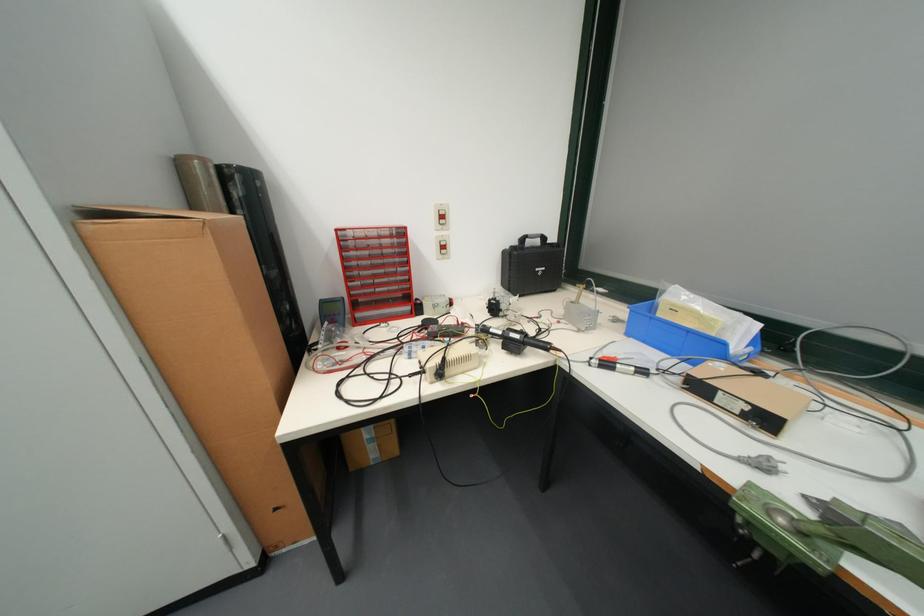
Find the location of a particular element. small cardboard box is located at coordinates (370, 445).